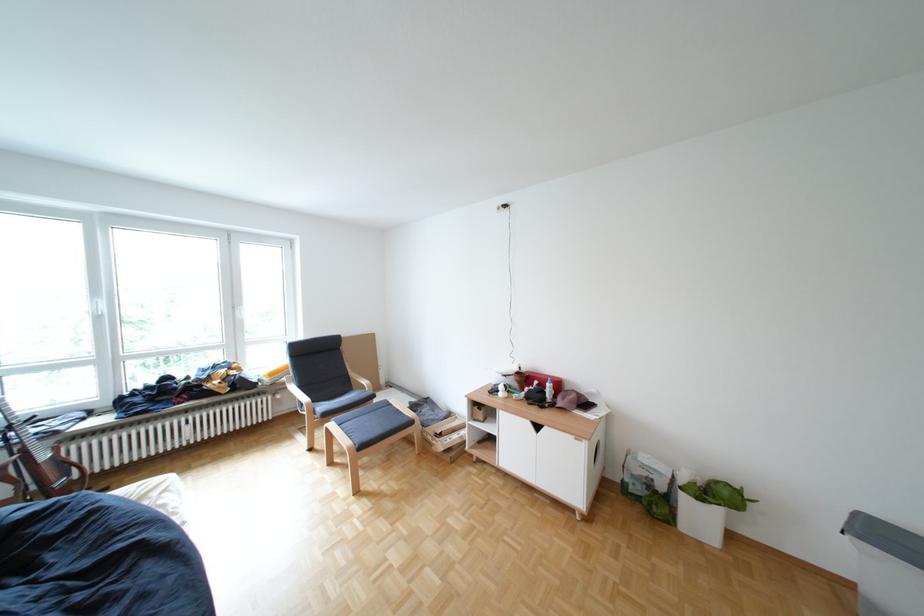
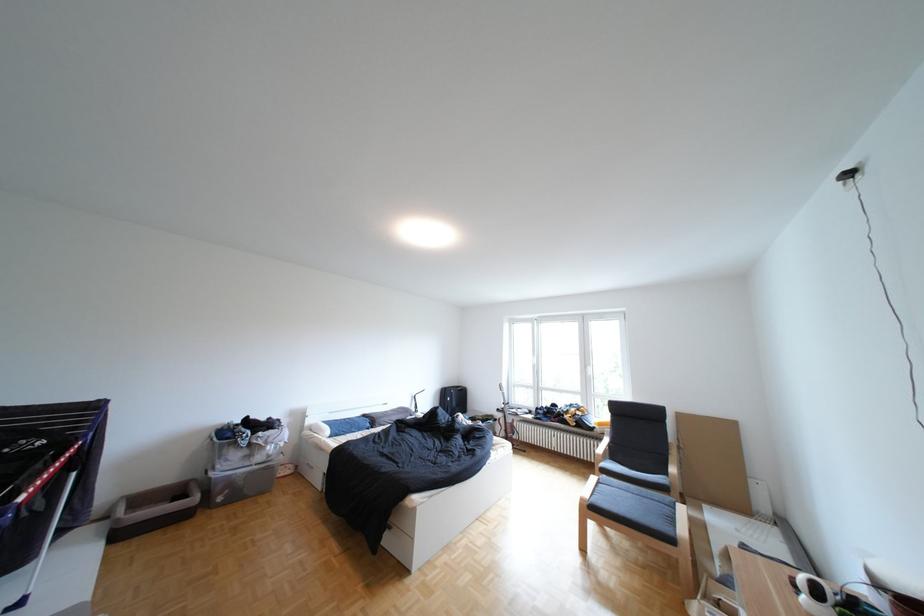
The point at (252, 456) is marked in the first image. Where is the corresponding point in the second image?

(584, 474)